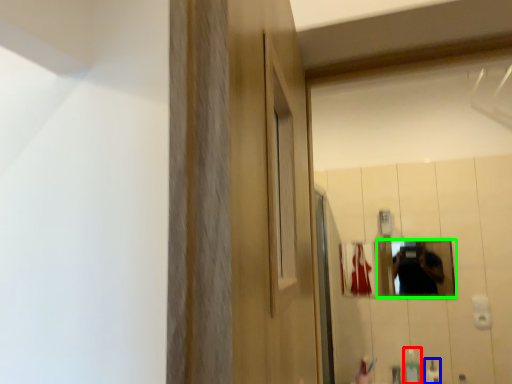
Question: Considering the real-world distances, which object is farthest from soap dispenser (highlighted by a red box)? mouthwash (highlighted by a blue box) or mirror (highlighted by a green box)?

Choices:
 (A) mouthwash
 (B) mirror

Answer: (B)